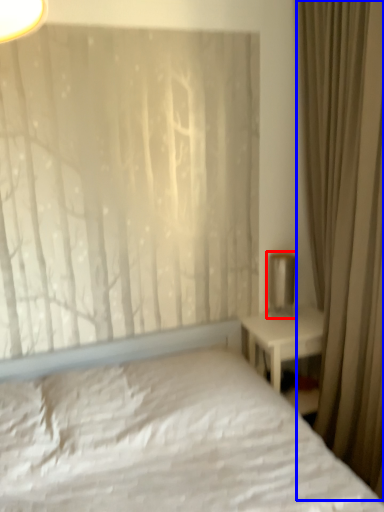
Question: Among these objects, which one is farthest to the camera, table lamp (highlighted by a red box) or curtain (highlighted by a blue box)?

Choices:
 (A) table lamp
 (B) curtain

Answer: (A)